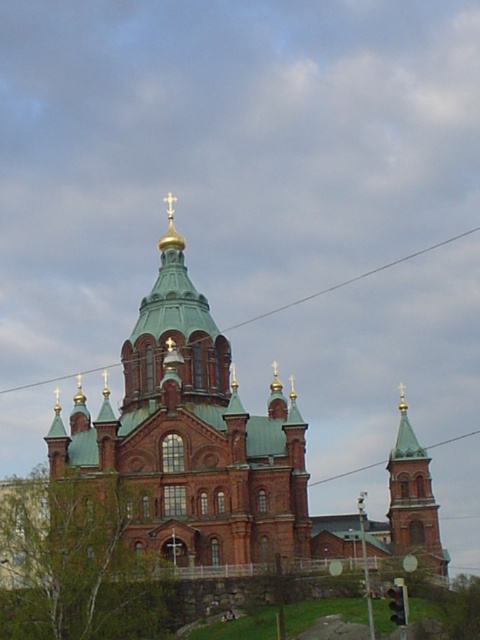
Does green copper dome at center have a lesser height compared to green glass tower at upper center?

No, green copper dome at center is not shorter than green glass tower at upper center.

Who is higher up, green copper dome at center or green glass tower at upper center?

Positioned higher is green copper dome at center.

Is point (325, 541) farther from viewer compared to point (411, 449)?

No, it is not.

Identify the location of green copper dome at center. This screenshot has height=640, width=480. (199, 440).